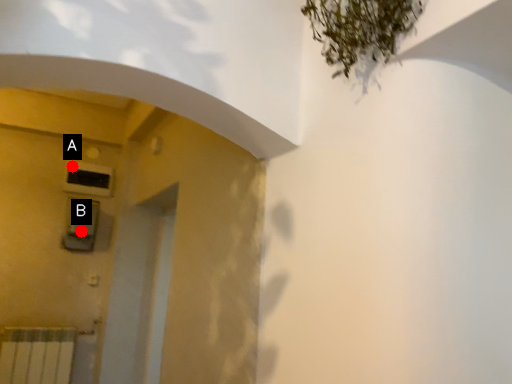
Question: Two points are circled on the image, labeled by A and B beside each circle. Which of the following is the farthest from the observer?

Choices:
 (A) A is further
 (B) B is further

Answer: (A)